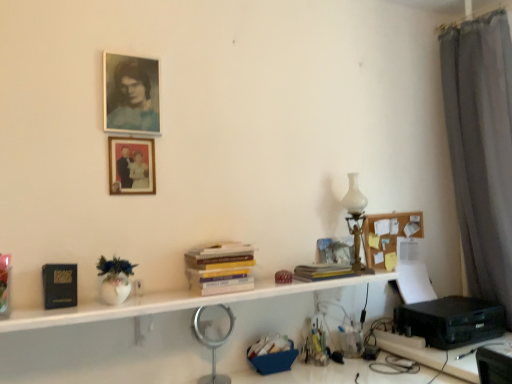
What is the approximate height of wooden framed photo at upper center, the second picture frame from the top?

9.11 inches.

This screenshot has width=512, height=384. What do you see at coordinates (131, 166) in the screenshot?
I see `wooden framed photo at upper center, the second picture frame from the top` at bounding box center [131, 166].

Locate an element on the screen. This screenshot has width=512, height=384. matte paper portrait at upper left, which appears as the 2th picture frame when ordered from the bottom is located at coordinates (131, 94).

The image size is (512, 384). What are the coordinates of `silver metallic magnifying glass at center` in the screenshot? It's located at (212, 345).

Where is `white glass table lamp at right`? white glass table lamp at right is located at coordinates (356, 220).

The height and width of the screenshot is (384, 512). In order to click on white matte shelf at center in this screenshot , I will do `click(174, 302)`.

From the picture: From a real-world perspective, relative to yellow paperbacks at center, the second book from the right, is black plastic printer at lower right vertically above or below?

Clearly, from a real-world perspective, black plastic printer at lower right is below yellow paperbacks at center, the second book from the right.

Which is in front, point (449, 318) or point (226, 245)?

The point (226, 245) is in front.

Based on the photo, is black plastic printer at lower right to the left of yellow paperbacks at center, the second book from the right, from the viewer's perspective?

No.

Is black plastic printer at lower right completely or partially outside of yellow paperbacks at center, positioned as the 1th book in left-to-right order?

Yes, black plastic printer at lower right is outside of yellow paperbacks at center, positioned as the 1th book in left-to-right order.

Is point (373, 220) positioned behind point (119, 56)?

That is True.

Can you confirm if corkboard at upper right is thinner than matte paper portrait at upper left, arranged as the 1th picture frame when viewed from the top?

Correct, the width of corkboard at upper right is less than that of matte paper portrait at upper left, arranged as the 1th picture frame when viewed from the top.

Considering the relative sizes of corkboard at upper right and matte paper portrait at upper left, which appears as the 2th picture frame when ordered from the bottom, in the image provided, is corkboard at upper right smaller than matte paper portrait at upper left, which appears as the 2th picture frame when ordered from the bottom,?

Actually, corkboard at upper right might be larger than matte paper portrait at upper left, which appears as the 2th picture frame when ordered from the bottom.

Is corkboard at upper right shorter than matte paper portrait at upper left, which appears as the 2th picture frame when ordered from the bottom?

Yes.

Does black plastic printer at lower right come behind yellow paper at center, the first book positioned from the right?

Yes.

Find the location of a particular element. book that is the 1st one when counting leftward from the black plastic printer at lower right is located at coordinates (322, 272).

Is yellow paper at center, which is the 2th book from left to right, completely or partially inside black plastic printer at lower right?

Definitely not — yellow paper at center, which is the 2th book from left to right, is not inside black plastic printer at lower right.

From the image's perspective, which is above, black plastic printer at lower right or yellow paper at center, which is the 2th book from left to right?

yellow paper at center, which is the 2th book from left to right.

Looking at this image, is wooden framed photo at upper center, the second picture frame from the top, aimed at matte paper portrait at upper left, arranged as the 1th picture frame when viewed from the top?

No, wooden framed photo at upper center, the second picture frame from the top, is not facing towards matte paper portrait at upper left, arranged as the 1th picture frame when viewed from the top.

Is wooden framed photo at upper center, the second picture frame from the top, not close to matte paper portrait at upper left, arranged as the 1th picture frame when viewed from the top?

wooden framed photo at upper center, the second picture frame from the top, is actually quite close to matte paper portrait at upper left, arranged as the 1th picture frame when viewed from the top.

Is wooden framed photo at upper center, the second picture frame from the top, taller or shorter than matte paper portrait at upper left, which appears as the 2th picture frame when ordered from the bottom?

Considering their sizes, wooden framed photo at upper center, the second picture frame from the top, has less height than matte paper portrait at upper left, which appears as the 2th picture frame when ordered from the bottom.

Looking at this image, from the image's perspective, is wooden framed photo at upper center, placed as the 1th picture frame when sorted from bottom to top, on top of matte paper portrait at upper left, arranged as the 1th picture frame when viewed from the top?

Incorrect, from the image's perspective, wooden framed photo at upper center, placed as the 1th picture frame when sorted from bottom to top, is lower than matte paper portrait at upper left, arranged as the 1th picture frame when viewed from the top.

Is black plastic printer at lower right taller or shorter than white glass table lamp at right?

Clearly, black plastic printer at lower right is shorter compared to white glass table lamp at right.

At what (x,y) coordinates should I click in order to perform the action: click on table lamp above the black plastic printer at lower right (from a real-world perspective). Please return your answer as a coordinate pair (x, y). The image size is (512, 384). Looking at the image, I should click on (356, 220).

From a real-world perspective, is black plastic printer at lower right positioned under white glass table lamp at right based on gravity?

Correct, in the physical world, black plastic printer at lower right is lower than white glass table lamp at right.

Is matte paper portrait at upper left, arranged as the 1th picture frame when viewed from the top, at the back of black plastic printer at lower right?

black plastic printer at lower right is not turned away from matte paper portrait at upper left, arranged as the 1th picture frame when viewed from the top.

Is point (456, 328) behind point (158, 130)?

Yes, point (456, 328) is farther from viewer.

Find the location of a particular element. printer behind the matte paper portrait at upper left, arranged as the 1th picture frame when viewed from the top is located at coordinates (451, 321).

From the image's perspective, relative to black matte book at left, is silver metallic magnifying glass at center above or below?

silver metallic magnifying glass at center is situated lower than black matte book at left in the image.

I want to click on paperback book above the silver metallic magnifying glass at center (from a real-world perspective), so click(59, 285).

Is silver metallic magnifying glass at center smaller than black matte book at left?

Actually, silver metallic magnifying glass at center might be larger than black matte book at left.

Where is `book that is the 2nd object located in front of the black plastic printer at lower right`? The height and width of the screenshot is (384, 512). book that is the 2nd object located in front of the black plastic printer at lower right is located at coordinates (220, 268).

Where is `bulletin board below the matte paper portrait at upper left, which appears as the 2th picture frame when ordered from the bottom (from a real-world perspective)`? bulletin board below the matte paper portrait at upper left, which appears as the 2th picture frame when ordered from the bottom (from a real-world perspective) is located at coordinates (389, 234).

Looking at the image, which one is located further to black plastic printer at lower right, yellow paperbacks at center, the second book from the right, or white matte shelf at center?

yellow paperbacks at center, the second book from the right, lies further to black plastic printer at lower right than the other object.

Estimate the real-world distances between objects in this image. Which object is closer to corkboard at upper right, matte paper portrait at upper left, which appears as the 2th picture frame when ordered from the bottom, or yellow paper at center, which is the 2th book from left to right?

Based on the image, yellow paper at center, which is the 2th book from left to right, appears to be nearer to corkboard at upper right.

Which object lies nearer to the anchor point black matte book at left, yellow paperbacks at center, positioned as the 1th book in left-to-right order, or yellow paper at center, which is the 2th book from left to right?

Among the two, yellow paperbacks at center, positioned as the 1th book in left-to-right order, is located nearer to black matte book at left.

Considering their positions, is corkboard at upper right positioned closer to silver metallic magnifying glass at center than wooden framed photo at upper center, placed as the 1th picture frame when sorted from bottom to top?

wooden framed photo at upper center, placed as the 1th picture frame when sorted from bottom to top.

Looking at the image, which one is located closer to white glass table lamp at right, yellow paper at center, the first book positioned from the right, or silver metallic magnifying glass at center?

The object closer to white glass table lamp at right is yellow paper at center, the first book positioned from the right.

Estimate the real-world distances between objects in this image. Which object is further from white glass table lamp at right, black matte book at left or matte paper portrait at upper left, arranged as the 1th picture frame when viewed from the top?

The object further to white glass table lamp at right is black matte book at left.

Looking at the image, which one is located further to wooden framed photo at upper center, placed as the 1th picture frame when sorted from bottom to top, matte paper portrait at upper left, which appears as the 2th picture frame when ordered from the bottom, or yellow paper at center, which is the 2th book from left to right?

yellow paper at center, which is the 2th book from left to right, lies further to wooden framed photo at upper center, placed as the 1th picture frame when sorted from bottom to top, than the other object.

Estimate the real-world distances between objects in this image. Which object is closer to white matte shelf at center, yellow paperbacks at center, the second book from the right, or black plastic printer at lower right?

Among the two, yellow paperbacks at center, the second book from the right, is located nearer to white matte shelf at center.

Image resolution: width=512 pixels, height=384 pixels. I want to click on book between white matte shelf at center and black plastic printer at lower right from left to right, so click(x=322, y=272).

Identify the location of bulletin board between yellow paperbacks at center, positioned as the 1th book in left-to-right order, and black plastic printer at lower right. The width and height of the screenshot is (512, 384). (389, 234).

This screenshot has width=512, height=384. In order to click on shelf between black matte book at left and black plastic printer at lower right in the horizontal direction in this screenshot , I will do `click(174, 302)`.

At what (x,y) coordinates should I click in order to perform the action: click on table lamp between black matte book at left and black plastic printer at lower right from left to right. Please return your answer as a coordinate pair (x, y). The width and height of the screenshot is (512, 384). Looking at the image, I should click on (356, 220).